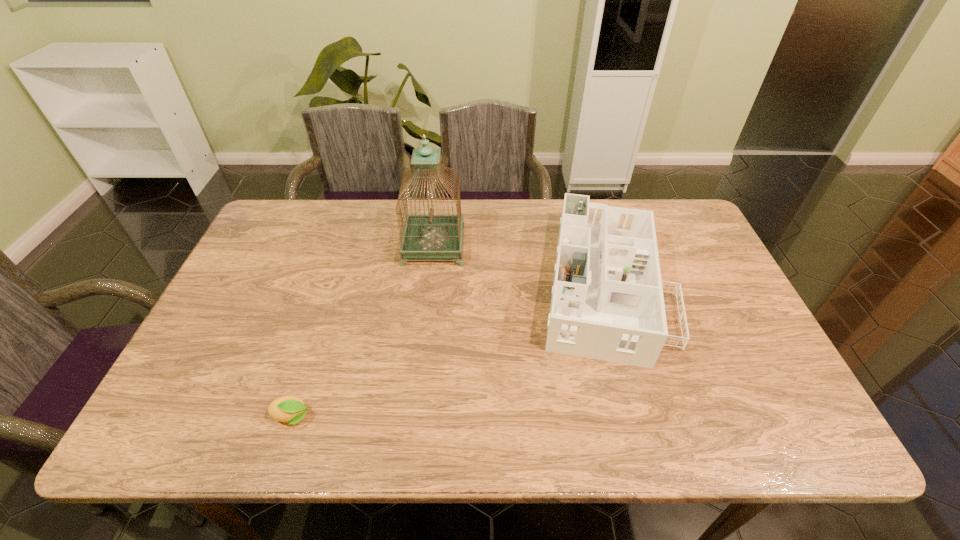
The height and width of the screenshot is (540, 960). In order to click on free spot that satisfies the following two spatial constraints: 1. at the door of the birdcage; 2. on the back side of the second tallest object in this screenshot , I will do 429,286.

Locate an element on the screen. Image resolution: width=960 pixels, height=540 pixels. vacant area in the image that satisfies the following two spatial constraints: 1. at the door of the rightmost object; 2. on the right side of the tallest object is located at coordinates (429, 286).

The height and width of the screenshot is (540, 960). I want to click on free space that satisfies the following two spatial constraints: 1. at the door of the rightmost object; 2. on the right side of the tallest object, so click(x=429, y=286).

Where is `blank space that satisfies the following two spatial constraints: 1. at the door of the dollhouse; 2. on the right side of the tallest object`? blank space that satisfies the following two spatial constraints: 1. at the door of the dollhouse; 2. on the right side of the tallest object is located at coordinates (429, 286).

Identify the location of free location that satisfies the following two spatial constraints: 1. on the back side of the second tallest object; 2. at the door of the tallest object. (592, 246).